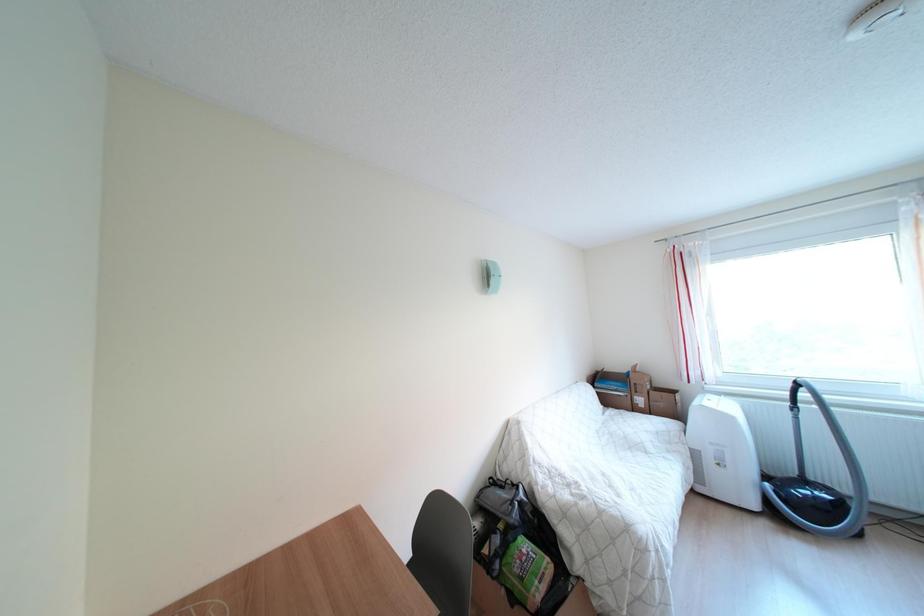
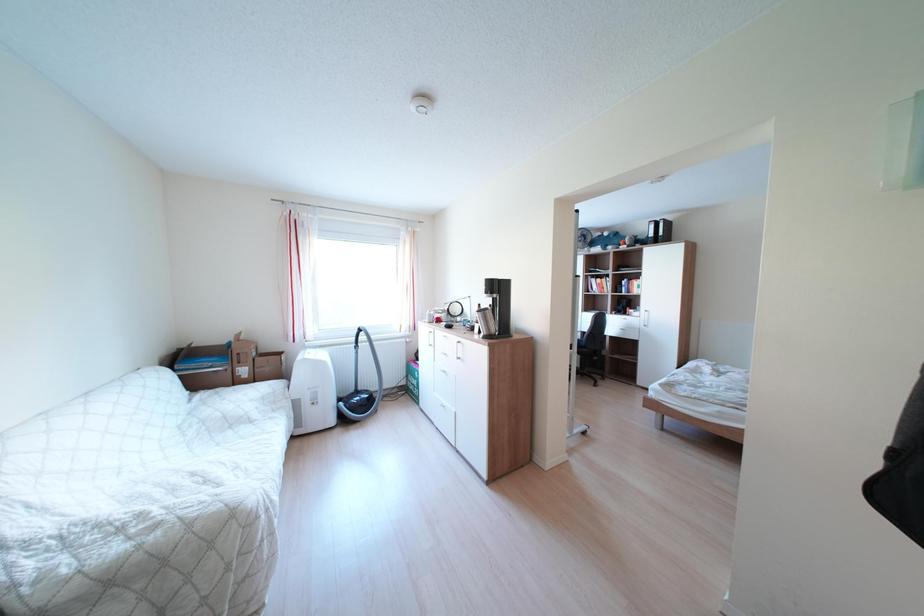
Question: How did the camera likely rotate?

Choices:
 (A) Left
 (B) Right
 (C) Up
 (D) Down

Answer: (B)